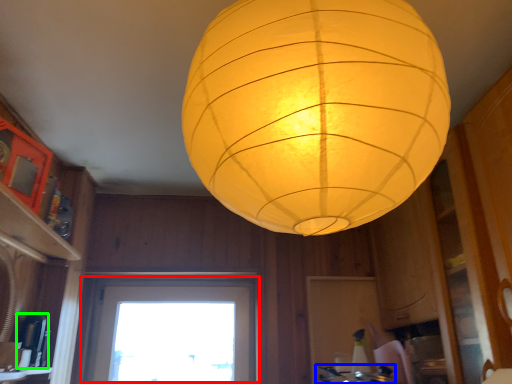
Question: Which object is positioned closest to window (highlighted by a red box)? Select from gas stove (highlighted by a blue box) and appliance (highlighted by a green box).

Choices:
 (A) gas stove
 (B) appliance

Answer: (B)